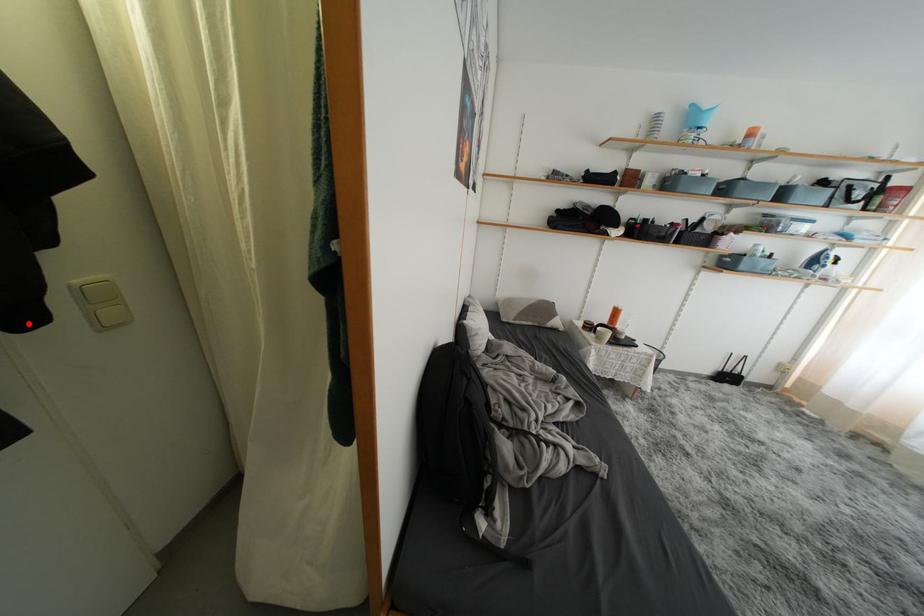
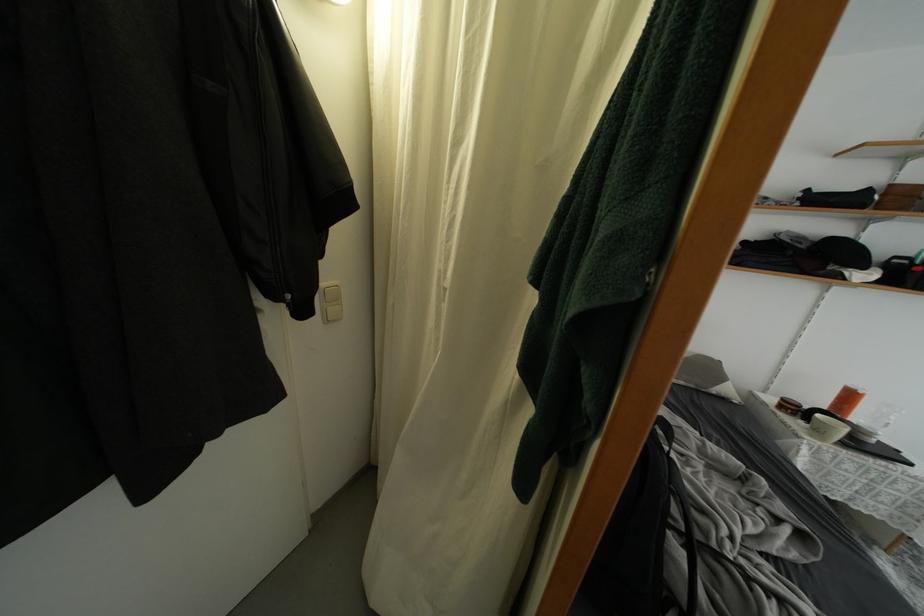
Where in the second image is the point corresponding to the highlighted location from the first image?

(310, 315)